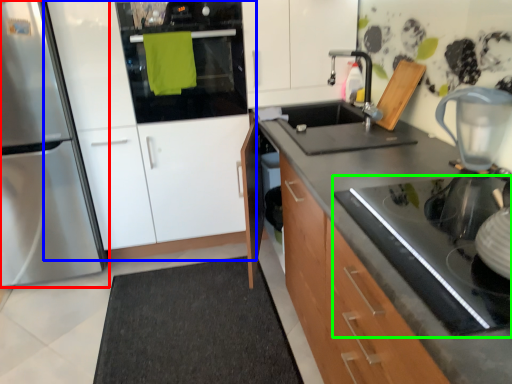
Question: Which object is positioned closest to home appliance (highlighted by a red box)? Select from cabinetry (highlighted by a blue box) and gas stove (highlighted by a green box).

Choices:
 (A) cabinetry
 (B) gas stove

Answer: (A)